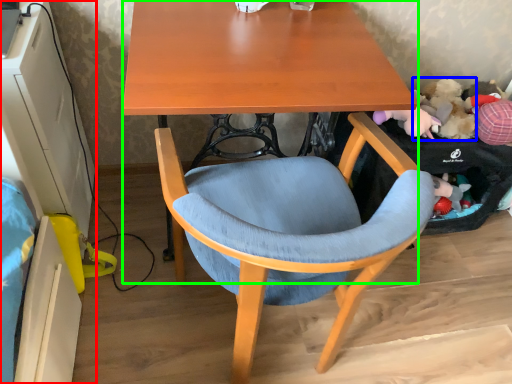
Question: Considering the real-world distances, which object is closest to computer desk (highlighted by a red box)? toy (highlighted by a blue box) or desk (highlighted by a green box).

Choices:
 (A) toy
 (B) desk

Answer: (B)